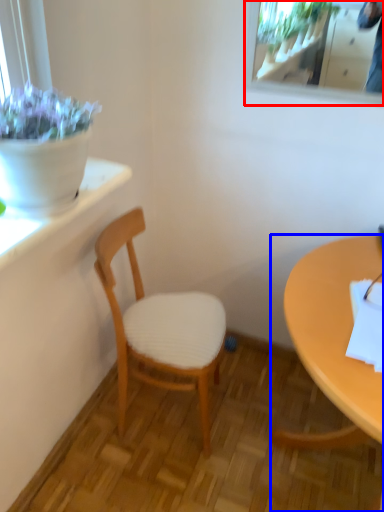
Question: Which object appears farthest to the camera in this image, mirror (highlighted by a red box) or desk (highlighted by a blue box)?

Choices:
 (A) mirror
 (B) desk

Answer: (A)